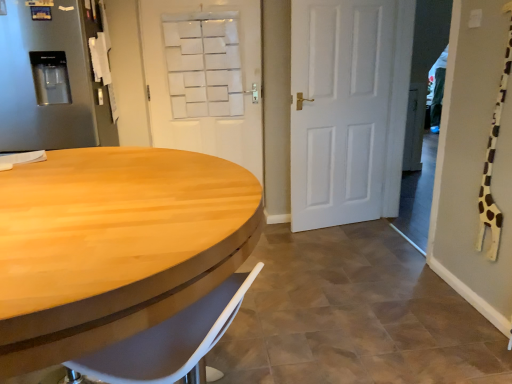
Question: Is light wood/wooden table at left to the right of white matte door at upper center, which is the 1th door from left to right, from the viewer's perspective?

Choices:
 (A) no
 (B) yes

Answer: (A)

Question: Can you confirm if light wood/wooden table at left is bigger than white matte door at upper center, which is counted as the second door, starting from the right?

Choices:
 (A) yes
 (B) no

Answer: (A)

Question: From a real-world perspective, does light wood/wooden table at left stand above white matte door at upper center, which is counted as the second door, starting from the right?

Choices:
 (A) no
 (B) yes

Answer: (A)

Question: Is white matte door at upper center, which is the 1th door from left to right, inside light wood/wooden table at left?

Choices:
 (A) yes
 (B) no

Answer: (B)

Question: Can you see light wood/wooden table at left touching white matte door at upper center, which is the 1th door from left to right?

Choices:
 (A) yes
 (B) no

Answer: (B)

Question: In terms of height, does light wood/wooden table at left look taller or shorter compared to white matte door at center, which is the first door in right-to-left order?

Choices:
 (A) short
 (B) tall

Answer: (A)

Question: From a real-world perspective, is light wood/wooden table at left physically located above or below white matte door at center, which is the first door in right-to-left order?

Choices:
 (A) above
 (B) below

Answer: (B)

Question: Is point (251, 185) closer or farther from the camera than point (291, 228)?

Choices:
 (A) farther
 (B) closer

Answer: (B)

Question: In terms of size, does light wood/wooden table at left appear bigger or smaller than white matte door at center, placed as the second door when sorted from left to right?

Choices:
 (A) big
 (B) small

Answer: (A)

Question: Considering the relative positions of white matte door at upper center, which is the 1th door from left to right, and satin silver refrigerator at left in the image provided, is white matte door at upper center, which is the 1th door from left to right, to the left or to the right of satin silver refrigerator at left?

Choices:
 (A) right
 (B) left

Answer: (A)

Question: From a real-world perspective, is white matte door at upper center, which is counted as the second door, starting from the right, physically located above or below satin silver refrigerator at left?

Choices:
 (A) below
 (B) above

Answer: (A)

Question: Is white matte door at upper center, which is counted as the second door, starting from the right, bigger or smaller than satin silver refrigerator at left?

Choices:
 (A) small
 (B) big

Answer: (A)

Question: Relative to satin silver refrigerator at left, is white matte door at upper center, which is the 1th door from left to right, in front or behind?

Choices:
 (A) front
 (B) behind

Answer: (B)

Question: From the image's perspective, is white matte door at upper center, which is the 1th door from left to right, positioned above or below light wood/wooden table at left?

Choices:
 (A) above
 (B) below

Answer: (A)

Question: Which is correct: white matte door at upper center, which is counted as the second door, starting from the right, is inside light wood/wooden table at left, or outside of it?

Choices:
 (A) outside
 (B) inside

Answer: (A)